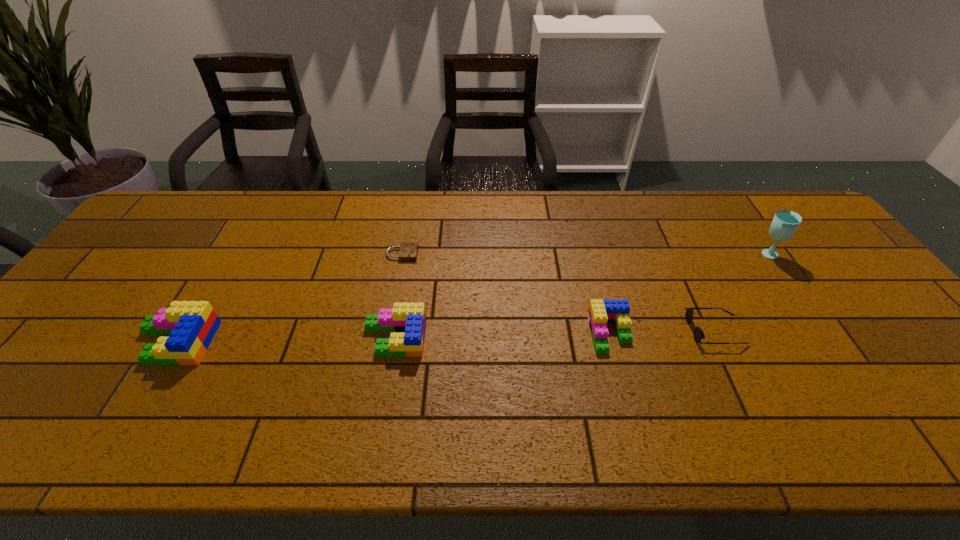
Identify the location of the leftmost object. [191, 325].

This screenshot has width=960, height=540. What are the coordinates of `the second tallest Lego` in the screenshot? It's located at (410, 318).

Find the location of a particular element. The image size is (960, 540). the second Lego from right to left is located at coordinates (410, 318).

Identify the location of the fourth object from left to right. (600, 312).

Locate an element on the screen. The height and width of the screenshot is (540, 960). the shortest Lego is located at coordinates (600, 312).

Where is `the rightmost object`? the rightmost object is located at coordinates (785, 223).

Locate an element on the screen. Image resolution: width=960 pixels, height=540 pixels. glass is located at coordinates (785, 223).

The width and height of the screenshot is (960, 540). I want to click on padlock, so click(x=408, y=251).

Identify the location of the second shortest object. The height and width of the screenshot is (540, 960). (698, 334).

Locate an element on the screen. The image size is (960, 540). sunglasses is located at coordinates (698, 334).